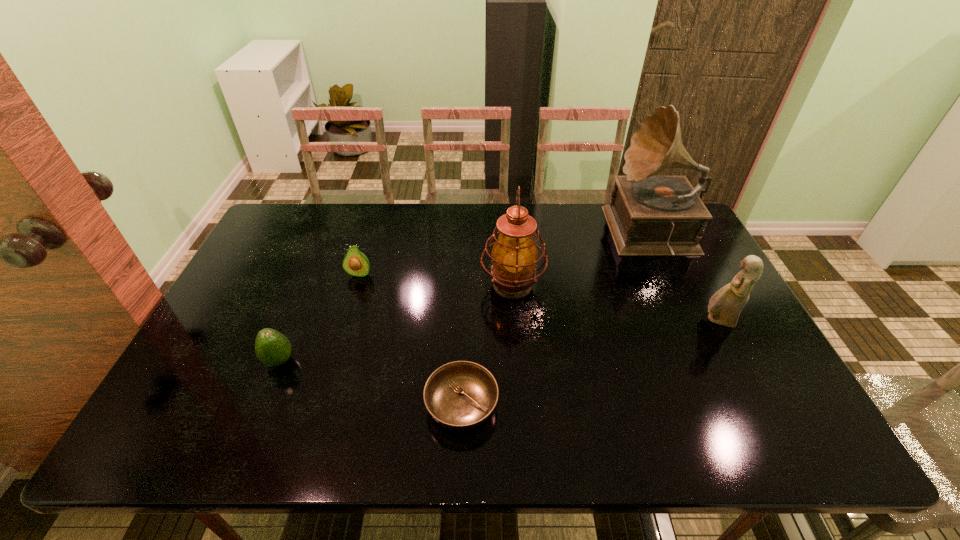
Find the location of `vacant space that satisfies the following two spatial constraints: 1. from the horn of the record player; 2. on the cut side of the right avocado`. vacant space that satisfies the following two spatial constraints: 1. from the horn of the record player; 2. on the cut side of the right avocado is located at coordinates (671, 274).

Identify the location of free point that satisfies the following two spatial constraints: 1. from the horn of the record player; 2. on the front side of the nearer avocado. click(x=712, y=361).

Find the location of a particular element. This screenshot has width=960, height=540. vacant space that satisfies the following two spatial constraints: 1. on the cut side of the nearest object; 2. on the right side of the right avocado is located at coordinates (321, 406).

Locate an element on the screen. The width and height of the screenshot is (960, 540). vacant space that satisfies the following two spatial constraints: 1. from the horn of the tallest object; 2. on the front side of the second tallest object is located at coordinates (677, 285).